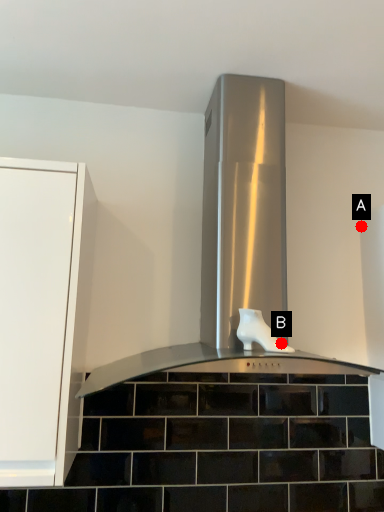
Question: Two points are circled on the image, labeled by A and B beside each circle. Which point is further to the camera?

Choices:
 (A) A is further
 (B) B is further

Answer: (A)